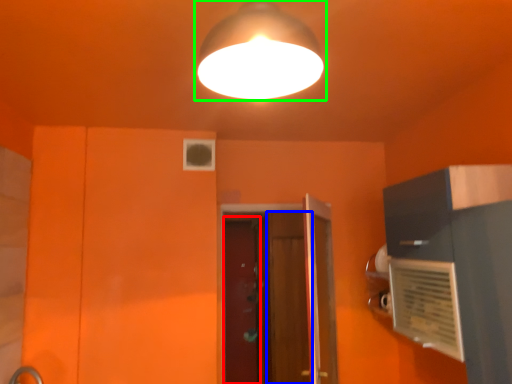
Question: Which object is the farthest from screen door (highlighted by a red box)? Choose among these: screen door (highlighted by a blue box) or lamp (highlighted by a green box).

Choices:
 (A) screen door
 (B) lamp

Answer: (B)